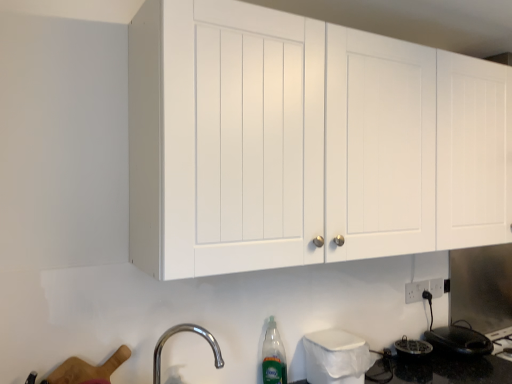
Question: In which direction should I rotate to look at white plastic trash can at lower center, the second appliance viewed from the back?

Choices:
 (A) left
 (B) right

Answer: (B)

Question: From a real-world perspective, is black glossy electric kettle at lower right, which appears as the first appliance when viewed from the right, over white matte cabinet at upper center?

Choices:
 (A) yes
 (B) no

Answer: (B)

Question: Is black glossy electric kettle at lower right, which ranks as the first appliance in back-to-front order, not near white matte cabinet at upper center?

Choices:
 (A) no
 (B) yes

Answer: (B)

Question: Is black glossy electric kettle at lower right, which ranks as the second appliance in left-to-right order, turned away from white matte cabinet at upper center?

Choices:
 (A) no
 (B) yes

Answer: (A)

Question: Does black glossy electric kettle at lower right, arranged as the 2th appliance when viewed from the front, have a greater height compared to white matte cabinet at upper center?

Choices:
 (A) no
 (B) yes

Answer: (A)

Question: From a real-world perspective, is black glossy electric kettle at lower right, which appears as the first appliance when viewed from the right, positioned under white matte cabinet at upper center based on gravity?

Choices:
 (A) no
 (B) yes

Answer: (B)

Question: Does black glossy electric kettle at lower right, arranged as the 2th appliance when viewed from the front, lie behind white matte cabinet at upper center?

Choices:
 (A) no
 (B) yes

Answer: (B)

Question: Is white matte cabinet at upper center to the left of black glossy electric kettle at lower right, which ranks as the second appliance in left-to-right order, from the viewer's perspective?

Choices:
 (A) yes
 (B) no

Answer: (A)

Question: Can you confirm if white matte cabinet at upper center is wider than black glossy electric kettle at lower right, which appears as the first appliance when viewed from the right?

Choices:
 (A) yes
 (B) no

Answer: (A)

Question: Considering the relative sizes of white matte cabinet at upper center and black glossy electric kettle at lower right, which appears as the first appliance when viewed from the right, in the image provided, is white matte cabinet at upper center bigger than black glossy electric kettle at lower right, which appears as the first appliance when viewed from the right,?

Choices:
 (A) no
 (B) yes

Answer: (B)

Question: Is the depth of white matte cabinet at upper center greater than that of black glossy electric kettle at lower right, which ranks as the first appliance in back-to-front order?

Choices:
 (A) yes
 (B) no

Answer: (B)

Question: Is white matte cabinet at upper center facing towards black glossy electric kettle at lower right, which ranks as the second appliance in left-to-right order?

Choices:
 (A) no
 (B) yes

Answer: (A)

Question: Is white matte cabinet at upper center not close to black glossy electric kettle at lower right, arranged as the 2th appliance when viewed from the front?

Choices:
 (A) no
 (B) yes

Answer: (B)

Question: Is the surface of chrome metallic faucet at lower left in direct contact with translucent plastic bottle at lower center?

Choices:
 (A) no
 (B) yes

Answer: (A)